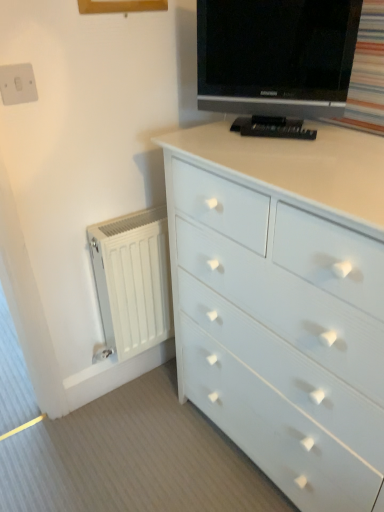
Question: Could you tell me if white painted wood chest of drawers at center is facing white matte radiator at left?

Choices:
 (A) yes
 (B) no

Answer: (B)

Question: Can you confirm if white painted wood chest of drawers at center is shorter than white matte radiator at left?

Choices:
 (A) no
 (B) yes

Answer: (A)

Question: Is white painted wood chest of drawers at center smaller than white matte radiator at left?

Choices:
 (A) yes
 (B) no

Answer: (B)

Question: Is the depth of white painted wood chest of drawers at center less than that of white matte radiator at left?

Choices:
 (A) no
 (B) yes

Answer: (B)

Question: Considering the relative sizes of white painted wood chest of drawers at center and white matte radiator at left in the image provided, is white painted wood chest of drawers at center wider than white matte radiator at left?

Choices:
 (A) no
 (B) yes

Answer: (B)

Question: Considering the relative sizes of white painted wood chest of drawers at center and white matte radiator at left in the image provided, is white painted wood chest of drawers at center thinner than white matte radiator at left?

Choices:
 (A) no
 (B) yes

Answer: (A)

Question: Is white plastic switch at upper left thinner than white matte radiator at left?

Choices:
 (A) yes
 (B) no

Answer: (A)

Question: Is white plastic switch at upper left to the left of white matte radiator at left from the viewer's perspective?

Choices:
 (A) yes
 (B) no

Answer: (A)

Question: Can you confirm if white plastic switch at upper left is shorter than white matte radiator at left?

Choices:
 (A) yes
 (B) no

Answer: (A)

Question: From a real-world perspective, is white plastic switch at upper left positioned under white matte radiator at left based on gravity?

Choices:
 (A) yes
 (B) no

Answer: (B)

Question: Is white plastic switch at upper left not close to white matte radiator at left?

Choices:
 (A) no
 (B) yes

Answer: (A)

Question: Is white plastic switch at upper left closer to camera compared to white matte radiator at left?

Choices:
 (A) yes
 (B) no

Answer: (A)

Question: Is white plastic switch at upper left oriented towards black glossy tv at upper center?

Choices:
 (A) no
 (B) yes

Answer: (A)